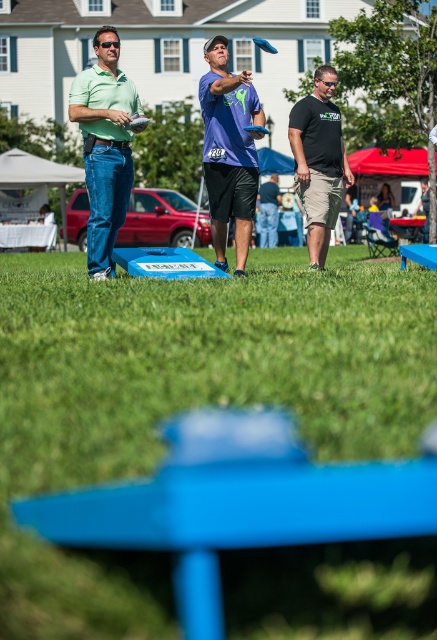
Question: Does matte green shirt at left have a greater width compared to black matte t-shirt at center?

Choices:
 (A) no
 (B) yes

Answer: (A)

Question: Where is purple matte t-shirt at center located in relation to blue fabric shorts at center in the image?

Choices:
 (A) above
 (B) below

Answer: (B)

Question: Which point appears closest to the camera in this image?

Choices:
 (A) pyautogui.click(x=319, y=138)
 (B) pyautogui.click(x=270, y=237)
 (C) pyautogui.click(x=118, y=44)
 (D) pyautogui.click(x=236, y=611)

Answer: (D)

Question: Considering the relative positions of green grass at center and purple matte t-shirt at center in the image provided, where is green grass at center located with respect to purple matte t-shirt at center?

Choices:
 (A) right
 (B) left

Answer: (A)

Question: Which object is farther from the camera taking this photo?

Choices:
 (A) black matte t-shirt at center
 (B) green grass at center
 (C) purple matte t-shirt at center

Answer: (A)

Question: Considering the real-world distances, which object is closest to the green grass at center?

Choices:
 (A) purple matte t-shirt at center
 (B) blue fabric shorts at center
 (C) black matte t-shirt at center
 (D) matte green shirt at left

Answer: (A)